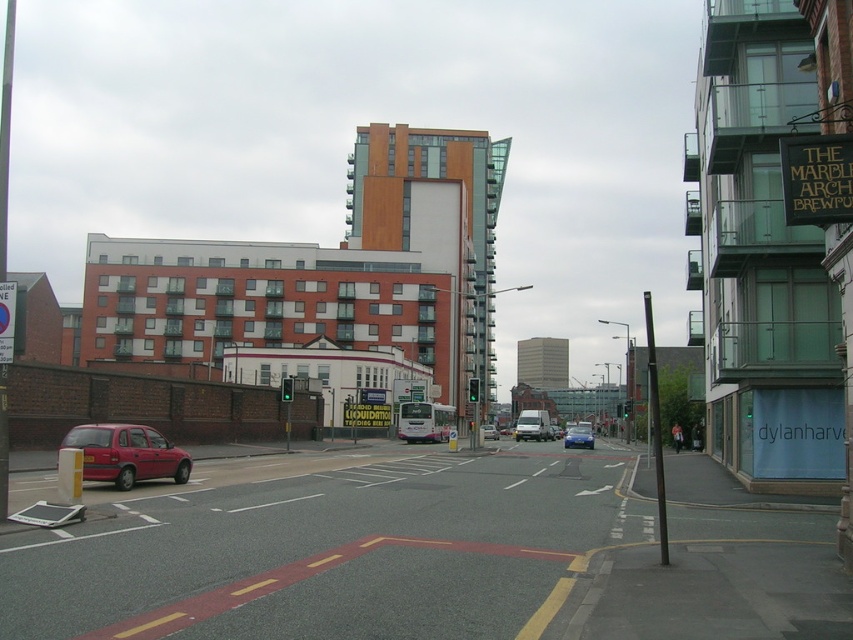
Question: Can you confirm if matte red car at lower left is positioned to the left of matte red car at center?

Choices:
 (A) yes
 (B) no

Answer: (A)

Question: Considering the relative positions of blue metallic sedan at center and matte red car at center in the image provided, where is blue metallic sedan at center located with respect to matte red car at center?

Choices:
 (A) left
 (B) right

Answer: (B)

Question: Considering the relative positions of matte red car at lower left and matte red car at center in the image provided, where is matte red car at lower left located with respect to matte red car at center?

Choices:
 (A) left
 (B) right

Answer: (A)

Question: Which object is farther from the camera taking this photo?

Choices:
 (A) blue metallic sedan at center
 (B) matte red car at lower left

Answer: (A)

Question: Based on their relative distances, which object is farther from the matte red car at center?

Choices:
 (A) matte red car at lower left
 (B) blue metallic sedan at center

Answer: (A)

Question: Among these points, which one is nearest to the camera?

Choices:
 (A) (585, 444)
 (B) (488, 433)
 (C) (144, 448)

Answer: (C)